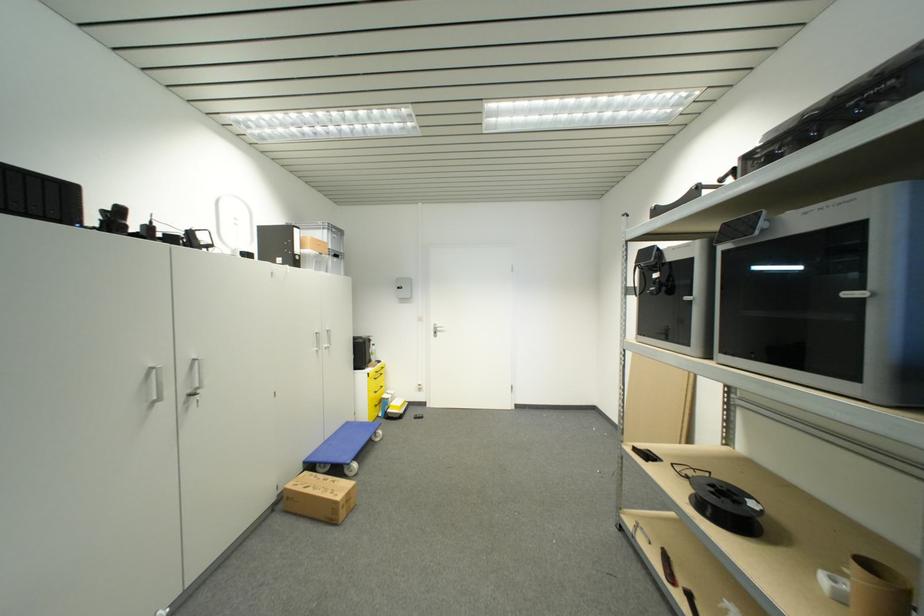
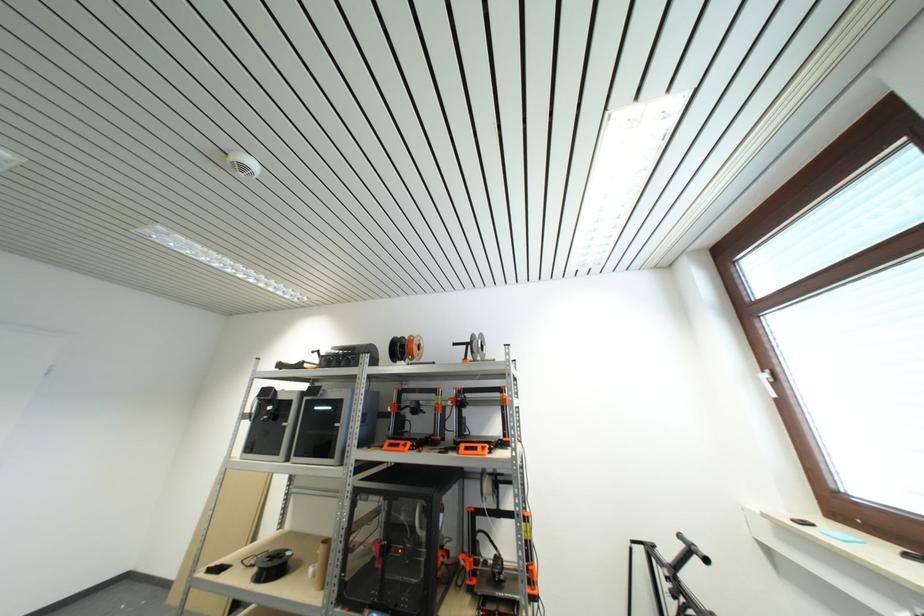
Locate, in the second image, the point that corresponds to pixel 691 347 in the first image.

(283, 456)